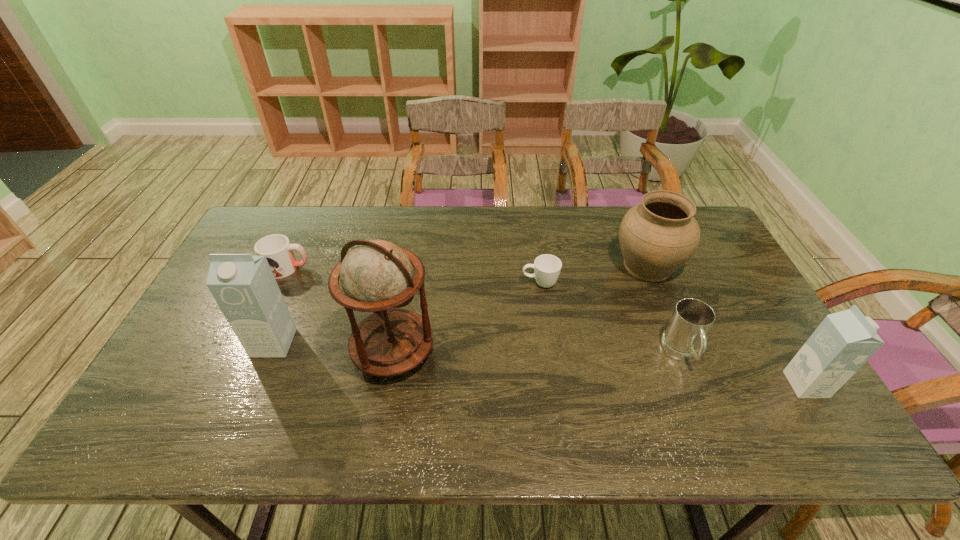
I want to click on vacant area between the shortest object and the globe, so click(x=467, y=318).

Locate an element on the screen. The image size is (960, 540). empty space between the urn and the right carton is located at coordinates (727, 325).

At what (x,y) coordinates should I click in order to perform the action: click on the fifth closest object relative to the rightmost object. Please return your answer as a coordinate pair (x, y). The width and height of the screenshot is (960, 540). Looking at the image, I should click on (244, 287).

I want to click on the fifth closest object to the right carton, so click(244, 287).

Locate an element on the screen. This screenshot has height=540, width=960. free space that satisfies the following two spatial constraints: 1. with the handle on the side of the fourth object from right to left; 2. on the surface of the fifth object from right to left is located at coordinates (550, 352).

You are a GUI agent. You are given a task and a screenshot of the screen. Output one action in this format:
    pyautogui.click(x=<x>, y=<y>)
    Task: Click on the free spot that satisfies the following two spatial constraints: 1. with the handle on the side of the shortest object; 2. on the front label of the taller carton
    This screenshot has width=960, height=540.
    Given the screenshot: What is the action you would take?
    pyautogui.click(x=548, y=343)

Identify the location of vacant region that satisfies the following two spatial constraints: 1. on the front side of the urn; 2. on the side of the sixth tallest object with the handle. This screenshot has width=960, height=540. (649, 268).